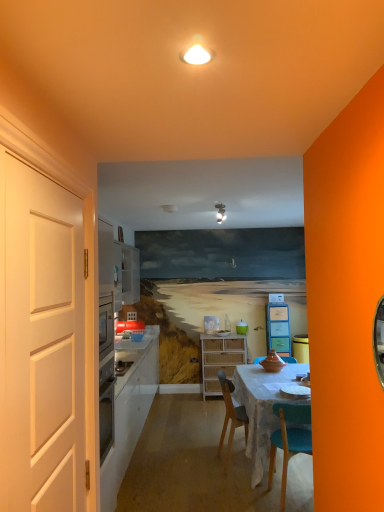
The image size is (384, 512). In order to click on woven wood cabinet at center, the 2th cabinetry viewed from the right in this screenshot , I will do `click(220, 359)`.

Measure the distance between point (220,210) and camera.

Point (220,210) is 13.33 feet away from camera.

This screenshot has height=512, width=384. In order to click on white matte door at left in this screenshot , I will do `click(41, 342)`.

Identify the location of woven wood cabinet at center, the first cabinetry viewed from the left. Image resolution: width=384 pixels, height=512 pixels. [x=220, y=359].

Are matte plastic cabinet at center, which is counted as the second cabinetry, starting from the left, and white matte door at left far apart?

matte plastic cabinet at center, which is counted as the second cabinetry, starting from the left, is positioned a significant distance from white matte door at left.

From a real-world perspective, relative to white matte door at left, is matte plastic cabinet at center, which is the 1th cabinetry in right-to-left order, vertically above or below?

matte plastic cabinet at center, which is the 1th cabinetry in right-to-left order, is situated lower than white matte door at left in the real world.

How different are the orientations of matte plastic cabinet at center, which is the 1th cabinetry in right-to-left order, and white matte door at left in degrees?

The angular difference between matte plastic cabinet at center, which is the 1th cabinetry in right-to-left order, and white matte door at left is 90.2 degrees.

Between woven wood cabinet at center, the first cabinetry viewed from the left, and white matte door at left, which one has less height?

woven wood cabinet at center, the first cabinetry viewed from the left, is shorter.

Considering the relative positions of woven wood cabinet at center, the first cabinetry viewed from the left, and white matte door at left in the image provided, is woven wood cabinet at center, the first cabinetry viewed from the left, in front of white matte door at left?

No, woven wood cabinet at center, the first cabinetry viewed from the left, is further to the viewer.

Based on their sizes in the image, would you say woven wood cabinet at center, the 2th cabinetry viewed from the right, is bigger or smaller than white matte door at left?

In the image, woven wood cabinet at center, the 2th cabinetry viewed from the right, appears to be larger than white matte door at left.

Considering the relative sizes of white matte door at left and matte plastic cabinet at center, which is the 1th cabinetry in right-to-left order, in the image provided, is white matte door at left bigger than matte plastic cabinet at center, which is the 1th cabinetry in right-to-left order,?

No, white matte door at left is not bigger than matte plastic cabinet at center, which is the 1th cabinetry in right-to-left order.

Considering the sizes of objects white matte door at left and matte plastic cabinet at center, which is counted as the second cabinetry, starting from the left, in the image provided, who is taller, white matte door at left or matte plastic cabinet at center, which is counted as the second cabinetry, starting from the left,?

With more height is white matte door at left.

Considering the sizes of objects white matte door at left and matte plastic cabinet at center, which is the 1th cabinetry in right-to-left order, in the image provided, who is thinner, white matte door at left or matte plastic cabinet at center, which is the 1th cabinetry in right-to-left order,?

Thinner between the two is white matte door at left.

How much distance is there between white matte door at left and matte plastic cabinet at center, which is the 1th cabinetry in right-to-left order?

They are 4.75 meters apart.

From their relative heights in the image, would you say matte white light fixture at upper center is taller or shorter than white matte door at left?

Considering their sizes, matte white light fixture at upper center has less height than white matte door at left.

Does matte white light fixture at upper center appear on the right side of white matte door at left?

Yes.

From the image's perspective, is matte white light fixture at upper center under white matte door at left?

Actually, matte white light fixture at upper center appears above white matte door at left in the image.

Is matte white light fixture at upper center facing towards white matte door at left?

Yes, matte white light fixture at upper center is turned towards white matte door at left.

From their relative heights in the image, would you say matte plastic cabinet at center, which is counted as the second cabinetry, starting from the left, is taller or shorter than woven wood cabinet at center, the 2th cabinetry viewed from the right?

Considering their sizes, matte plastic cabinet at center, which is counted as the second cabinetry, starting from the left, has less height than woven wood cabinet at center, the 2th cabinetry viewed from the right.

Is matte plastic cabinet at center, which is counted as the second cabinetry, starting from the left, positioned before woven wood cabinet at center, the first cabinetry viewed from the left?

No.

Is woven wood cabinet at center, the 2th cabinetry viewed from the right, surrounded by matte plastic cabinet at center, which is counted as the second cabinetry, starting from the left?

No, woven wood cabinet at center, the 2th cabinetry viewed from the right, is not a part of matte plastic cabinet at center, which is counted as the second cabinetry, starting from the left.

Looking at this image, what's the angular difference between matte plastic cabinet at center, which is the 1th cabinetry in right-to-left order, and woven wood cabinet at center, the first cabinetry viewed from the left,'s facing directions?

The angular difference between matte plastic cabinet at center, which is the 1th cabinetry in right-to-left order, and woven wood cabinet at center, the first cabinetry viewed from the left, is 0.879 degrees.

From a real-world perspective, is white matte door at left positioned above or below matte white light fixture at upper center?

From a real-world perspective, white matte door at left is physically below matte white light fixture at upper center.

Is white matte door at left positioned beyond the bounds of matte white light fixture at upper center?

Yes, white matte door at left is outside of matte white light fixture at upper center.

Can you confirm if white matte door at left is taller than matte white light fixture at upper center?

Indeed, white matte door at left has a greater height compared to matte white light fixture at upper center.

How distant is white matte door at left from matte white light fixture at upper center?

white matte door at left and matte white light fixture at upper center are 2.72 meters apart.

Would you say woven wood cabinet at center, the first cabinetry viewed from the left, contains matte plastic cabinet at center, which is counted as the second cabinetry, starting from the left?

No.

Is woven wood cabinet at center, the 2th cabinetry viewed from the right, taller or shorter than matte plastic cabinet at center, which is counted as the second cabinetry, starting from the left?

woven wood cabinet at center, the 2th cabinetry viewed from the right, is taller than matte plastic cabinet at center, which is counted as the second cabinetry, starting from the left.

Is woven wood cabinet at center, the first cabinetry viewed from the left, wider than matte plastic cabinet at center, which is counted as the second cabinetry, starting from the left?

Yes, woven wood cabinet at center, the first cabinetry viewed from the left, is wider than matte plastic cabinet at center, which is counted as the second cabinetry, starting from the left.

Consider the image. Is woven wood cabinet at center, the first cabinetry viewed from the left, facing towards matte plastic cabinet at center, which is counted as the second cabinetry, starting from the left?

No, woven wood cabinet at center, the first cabinetry viewed from the left, is not facing towards matte plastic cabinet at center, which is counted as the second cabinetry, starting from the left.

I want to click on door on the left of matte plastic cabinet at center, which is the 1th cabinetry in right-to-left order, so click(x=41, y=342).

Where is `door lying above the woven wood cabinet at center, the 2th cabinetry viewed from the right (from the image's perspective)`? This screenshot has width=384, height=512. door lying above the woven wood cabinet at center, the 2th cabinetry viewed from the right (from the image's perspective) is located at coordinates (41, 342).

Estimate the real-world distances between objects in this image. Which object is closer to matte plastic cabinet at center, which is counted as the second cabinetry, starting from the left, matte white light fixture at upper center or woven wood cabinet at center, the 2th cabinetry viewed from the right?

woven wood cabinet at center, the 2th cabinetry viewed from the right, is closer to matte plastic cabinet at center, which is counted as the second cabinetry, starting from the left.

When comparing their distances from white matte door at left, does matte white light fixture at upper center or woven wood cabinet at center, the first cabinetry viewed from the left, seem closer?

The object closer to white matte door at left is matte white light fixture at upper center.

When comparing their distances from woven wood cabinet at center, the first cabinetry viewed from the left, does matte plastic cabinet at center, which is counted as the second cabinetry, starting from the left, or white matte door at left seem further?

Among the two, white matte door at left is located further to woven wood cabinet at center, the first cabinetry viewed from the left.

Consider the image. Which object lies nearer to the anchor point white matte door at left, matte white light fixture at upper center or matte plastic cabinet at center, which is the 1th cabinetry in right-to-left order?

The object closer to white matte door at left is matte white light fixture at upper center.

Which object lies further to the anchor point matte white light fixture at upper center, white matte door at left or matte plastic cabinet at center, which is counted as the second cabinetry, starting from the left?

Among the two, white matte door at left is located further to matte white light fixture at upper center.

Consider the image. Considering their positions, is white matte door at left positioned further to matte plastic cabinet at center, which is the 1th cabinetry in right-to-left order, than woven wood cabinet at center, the first cabinetry viewed from the left?

Among the two, white matte door at left is located further to matte plastic cabinet at center, which is the 1th cabinetry in right-to-left order.

Which object lies nearer to the anchor point matte white light fixture at upper center, matte plastic cabinet at center, which is the 1th cabinetry in right-to-left order, or white matte door at left?

Among the two, matte plastic cabinet at center, which is the 1th cabinetry in right-to-left order, is located nearer to matte white light fixture at upper center.

When comparing their distances from matte white light fixture at upper center, does white matte door at left or woven wood cabinet at center, the first cabinetry viewed from the left, seem closer?

Based on the image, woven wood cabinet at center, the first cabinetry viewed from the left, appears to be nearer to matte white light fixture at upper center.

The image size is (384, 512). Find the location of `light fixture positioned between white matte door at left and woven wood cabinet at center, the first cabinetry viewed from the left, from near to far`. light fixture positioned between white matte door at left and woven wood cabinet at center, the first cabinetry viewed from the left, from near to far is located at coordinates (220, 212).

Locate an element on the screen. cabinetry between white matte door at left and matte plastic cabinet at center, which is the 1th cabinetry in right-to-left order, along the z-axis is located at coordinates (220, 359).

At what (x,y) coordinates should I click in order to perform the action: click on cabinetry between matte white light fixture at upper center and matte plastic cabinet at center, which is counted as the second cabinetry, starting from the left, from front to back. Please return your answer as a coordinate pair (x, y). Image resolution: width=384 pixels, height=512 pixels. Looking at the image, I should click on (220, 359).

Image resolution: width=384 pixels, height=512 pixels. Identify the location of light fixture between white matte door at left and matte plastic cabinet at center, which is the 1th cabinetry in right-to-left order, along the z-axis. 220,212.